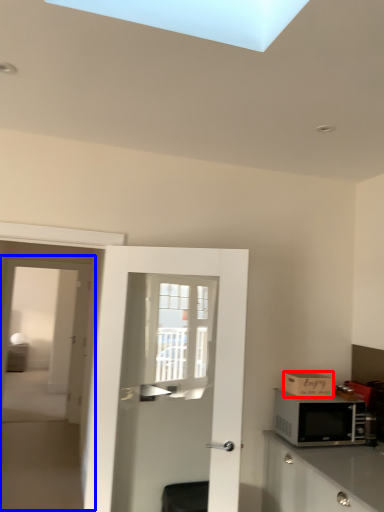
Question: Among these objects, which one is nearest to the camera, cardboard box (highlighted by a red box) or screen door (highlighted by a blue box)?

Choices:
 (A) cardboard box
 (B) screen door

Answer: (B)